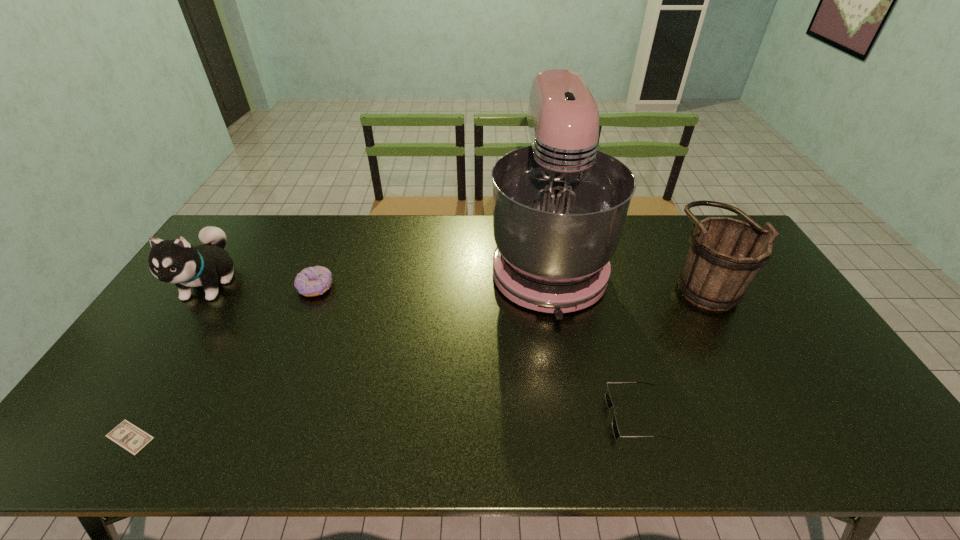
The width and height of the screenshot is (960, 540). I want to click on sunglasses that is at the near edge, so click(x=609, y=403).

This screenshot has height=540, width=960. Identify the location of money situated at the near edge. (127, 435).

Find the location of a particular element. The image size is (960, 540). puppy present at the left edge is located at coordinates tap(177, 262).

Locate an element on the screen. money that is positioned at the left edge is located at coordinates (127, 435).

Find the location of a particular element. The width and height of the screenshot is (960, 540). object that is at the right edge is located at coordinates (725, 255).

Identify the location of object positioned at the far left corner. This screenshot has height=540, width=960. (177, 262).

The width and height of the screenshot is (960, 540). Identify the location of object positioned at the near left corner. (127, 435).

This screenshot has width=960, height=540. Identify the location of object located at the far right corner. tap(725, 255).

Where is `vacant space at the far edge of the desktop`? Image resolution: width=960 pixels, height=540 pixels. vacant space at the far edge of the desktop is located at coordinates (420, 253).

Where is `vacant space at the near edge`? The width and height of the screenshot is (960, 540). vacant space at the near edge is located at coordinates (307, 456).